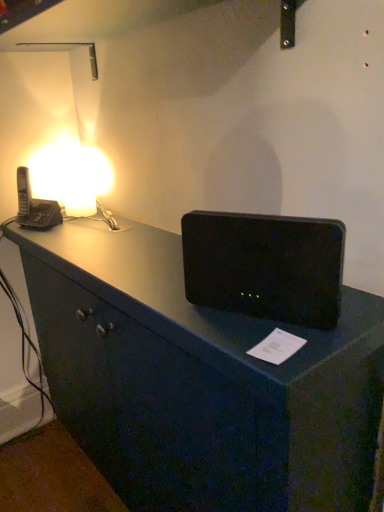
Question: From a real-world perspective, is black plastic speaker at center physically below matte white lamp at upper left?

Choices:
 (A) yes
 (B) no

Answer: (A)

Question: Considering the relative sizes of black plastic speaker at center and matte white lamp at upper left in the image provided, is black plastic speaker at center thinner than matte white lamp at upper left?

Choices:
 (A) yes
 (B) no

Answer: (A)

Question: Is black plastic speaker at center completely or partially outside of matte white lamp at upper left?

Choices:
 (A) no
 (B) yes

Answer: (B)

Question: Is black plastic speaker at center surrounding matte white lamp at upper left?

Choices:
 (A) no
 (B) yes

Answer: (A)

Question: Is black plastic speaker at center not close to matte white lamp at upper left?

Choices:
 (A) yes
 (B) no

Answer: (B)

Question: Is the depth of black plastic speaker at center greater than that of matte white lamp at upper left?

Choices:
 (A) yes
 (B) no

Answer: (B)

Question: Is matte white lamp at upper left positioned behind black plastic speaker at center?

Choices:
 (A) no
 (B) yes

Answer: (B)

Question: Would you say matte white lamp at upper left contains black plastic speaker at center?

Choices:
 (A) yes
 (B) no

Answer: (B)

Question: From the image's perspective, is matte white lamp at upper left on top of black plastic speaker at center?

Choices:
 (A) yes
 (B) no

Answer: (A)

Question: Is matte white lamp at upper left positioned far away from black plastic speaker at center?

Choices:
 (A) no
 (B) yes

Answer: (A)

Question: Does matte white lamp at upper left have a smaller size compared to black plastic speaker at center?

Choices:
 (A) no
 (B) yes

Answer: (B)

Question: Can you confirm if matte white lamp at upper left is thinner than black plastic speaker at center?

Choices:
 (A) no
 (B) yes

Answer: (A)

Question: From the image's perspective, is black plastic phone at left located beneath matte white lamp at upper left?

Choices:
 (A) no
 (B) yes

Answer: (B)